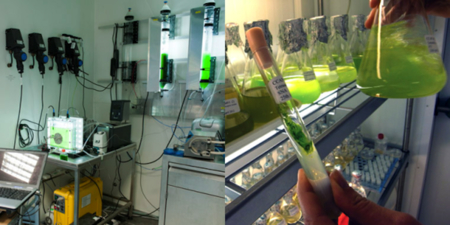
Find the location of a particular element. This screenshot has width=450, height=225. laptop screen is located at coordinates (16, 162).